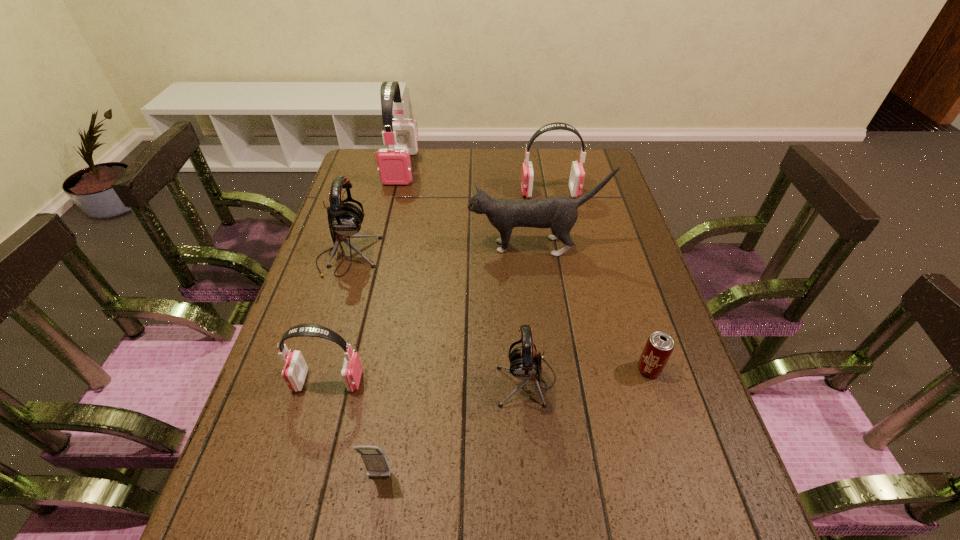
I want to click on free point between the second smallest pink earphone and the shortest object, so click(x=599, y=281).

Find the location of a particular element. vacant space that is in between the shortest object and the nearest pink earphone is located at coordinates (489, 375).

Find the location of a particular element. empty location between the rightmost pink earphone and the bigger black earphone is located at coordinates (449, 225).

Image resolution: width=960 pixels, height=540 pixels. I want to click on object that ranks as the fifth closest to the shortest object, so click(x=577, y=174).

Locate an element on the screen. object identified as the closest to the rightmost pink earphone is located at coordinates (559, 213).

Choose which earphone is the third nearest neighbor to the rightmost pink earphone. Please provide its 2D coordinates. Your answer should be formatted as a tuple, i.e. [(x, y)], where the tuple contains the x and y coordinates of a point satisfying the conditions above.

[(525, 363)]

Locate an element on the screen. This screenshot has height=540, width=960. the closest earphone to the tallest earphone is located at coordinates (345, 219).

Find the location of a particular element. pink earphone that is the second closest one to the biggest pink earphone is located at coordinates (295, 369).

Find the location of `pink earphone that is the second nearest to the farther black earphone`. pink earphone that is the second nearest to the farther black earphone is located at coordinates (295, 369).

The image size is (960, 540). What are the coordinates of `vacant space that satisfies the following two spatial constraints: 1. at the face of the shortest object; 2. on the right side of the cat` in the screenshot? It's located at (551, 369).